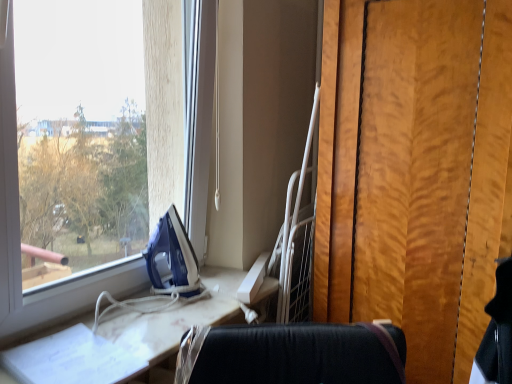
You are a GUI agent. You are given a task and a screenshot of the screen. Output one action in this format:
    pyautogui.click(x=<x>, y=<y>)
    Task: Click on the vacant area on top of white glossy ironing board at left (from a real-world perspective)
    
    Given the screenshot: What is the action you would take?
    pyautogui.click(x=150, y=317)